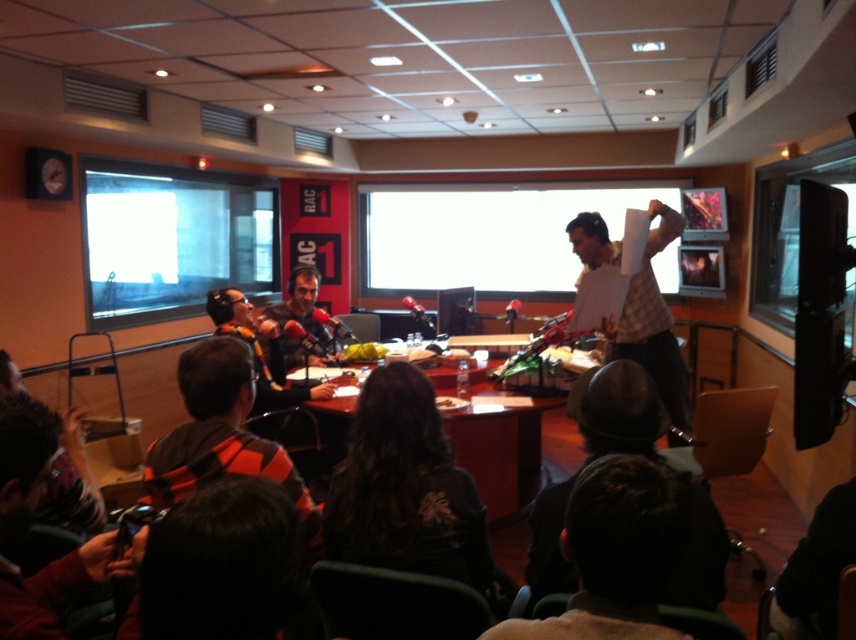
Question: Which object appears closest to the camera in this image?

Choices:
 (A) plaid fabric shirt at center
 (B) matte black headphones at center
 (C) orange and black scarf at lower left

Answer: (C)

Question: Does matte glass projection screen at upper left lie behind matte black headphones at center?

Choices:
 (A) yes
 (B) no

Answer: (A)

Question: Among these points, which one is farthest from the camera?

Choices:
 (A) (277, 240)
 (B) (619, 378)
 (C) (294, 305)
 (D) (210, 362)

Answer: (A)

Question: Can you confirm if matte black helmet at lower center is thinner than matte black microphone at center?

Choices:
 (A) no
 (B) yes

Answer: (A)

Question: Which point appears closest to the camera in this image?

Choices:
 (A) (412, 468)
 (B) (281, 316)
 (C) (327, 394)

Answer: (A)

Question: Where is white paper at center located in relation to wooden table at center in the image?

Choices:
 (A) left
 (B) right

Answer: (B)